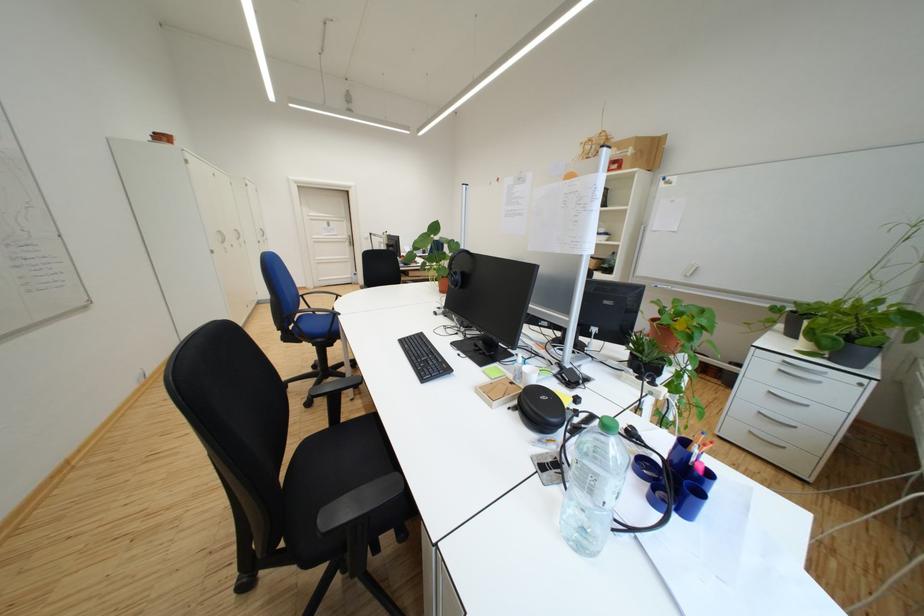
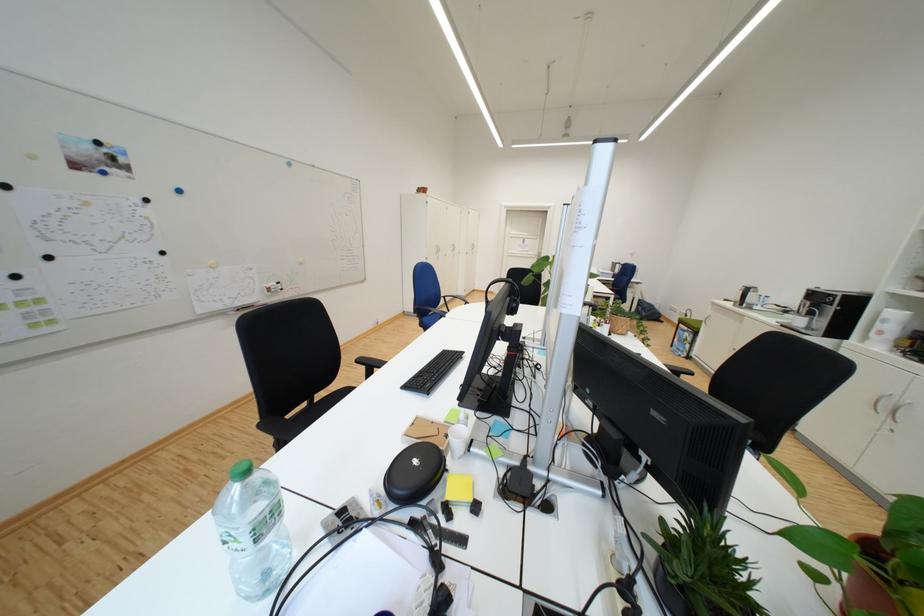
Question: The camera is either moving clockwise (left) or counter-clockwise (right) around the object. The first image is from the beginning of the video and the second image is from the end. Is the camera moving left or right when shooting the video?

Choices:
 (A) Left
 (B) Right

Answer: (B)